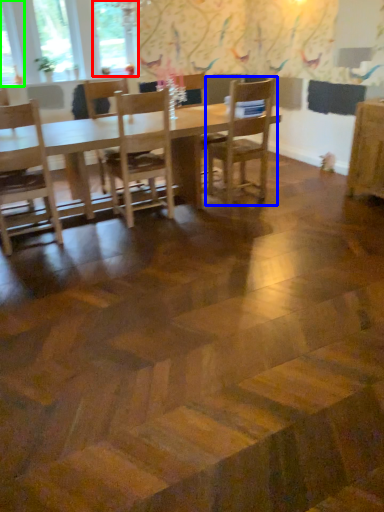
Question: Estimate the real-world distances between objects in this image. Which object is farther from window (highlighted by a red box), chair (highlighted by a blue box) or window (highlighted by a green box)?

Choices:
 (A) chair
 (B) window

Answer: (A)